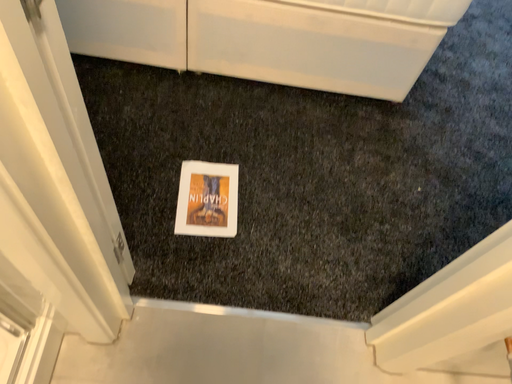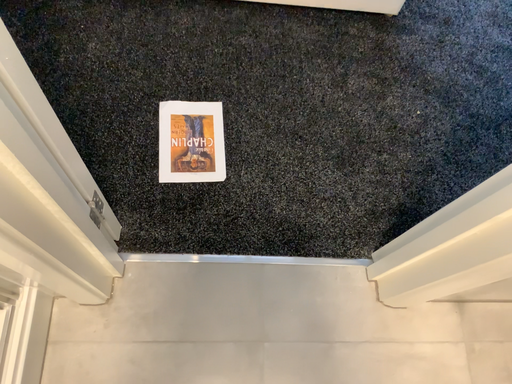
Question: How did the camera likely rotate when shooting the video?

Choices:
 (A) rotated upward
 (B) rotated downward

Answer: (B)